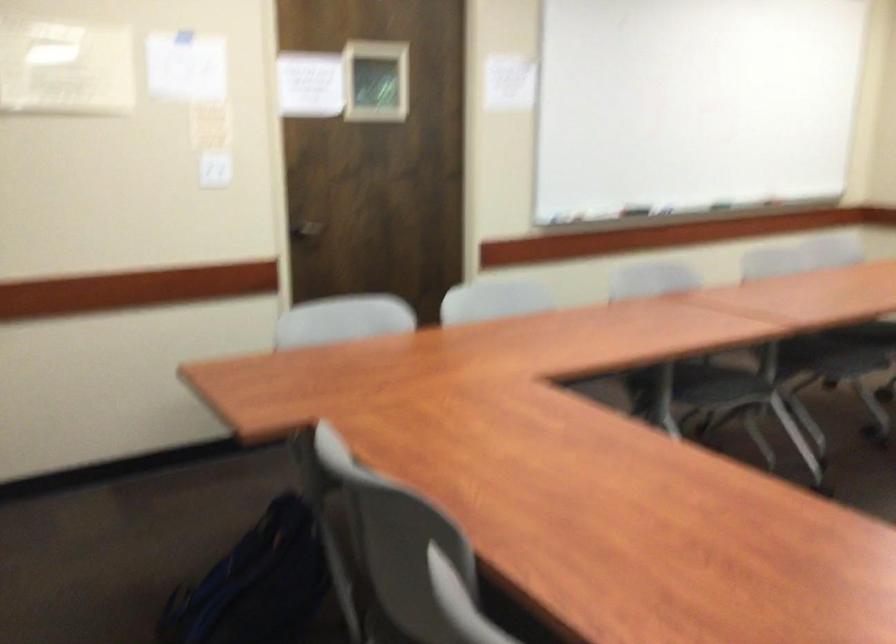
The images are taken continuously from a first-person perspective. In which direction is your viewpoint rotating?

The rotation direction of the camera is left-down.